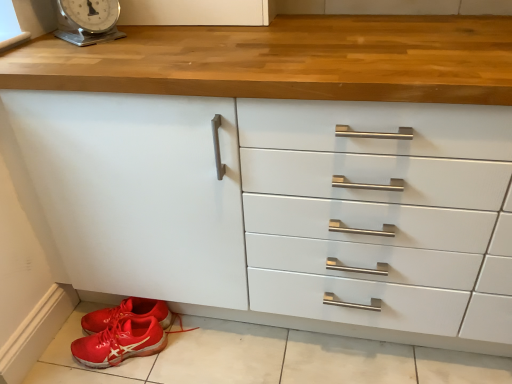
Question: Looking at their shapes, would you say shiny red sneakers at lower left is wider or thinner than red rubber shoe at lower left?

Choices:
 (A) thin
 (B) wide

Answer: (A)

Question: From the image's perspective, is shiny red sneakers at lower left positioned above or below red rubber shoe at lower left?

Choices:
 (A) above
 (B) below

Answer: (A)

Question: Considering the real-world distances, which object is closest to the shiny red sneakers at lower left?

Choices:
 (A) metallic silver scale at upper left
 (B) red rubber shoe at lower left

Answer: (B)

Question: Estimate the real-world distances between objects in this image. Which object is closer to the red rubber shoe at lower left?

Choices:
 (A) shiny red sneakers at lower left
 (B) metallic silver scale at upper left

Answer: (A)